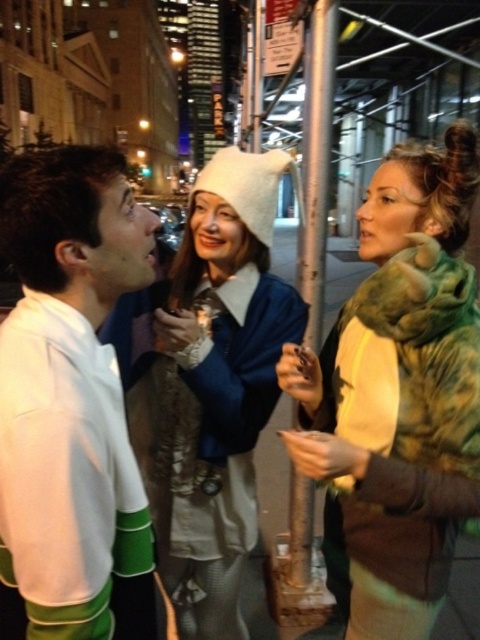
Question: Among these objects, which one is nearest to the camera?

Choices:
 (A) green fur coat at right
 (B) white fuzzy hat at center

Answer: (A)

Question: Does green fur coat at right come in front of white fabric shirt at left?

Choices:
 (A) no
 (B) yes

Answer: (A)

Question: Does green fur coat at right have a lesser width compared to white fabric shirt at left?

Choices:
 (A) no
 (B) yes

Answer: (A)

Question: Among these objects, which one is nearest to the camera?

Choices:
 (A) white fabric shirt at left
 (B) green fur coat at right

Answer: (A)

Question: Does green fur coat at right have a lesser width compared to white fuzzy hat at center?

Choices:
 (A) yes
 (B) no

Answer: (A)

Question: Which object is the farthest from the green fur coat at right?

Choices:
 (A) white fuzzy hat at center
 (B) white fabric shirt at left

Answer: (B)